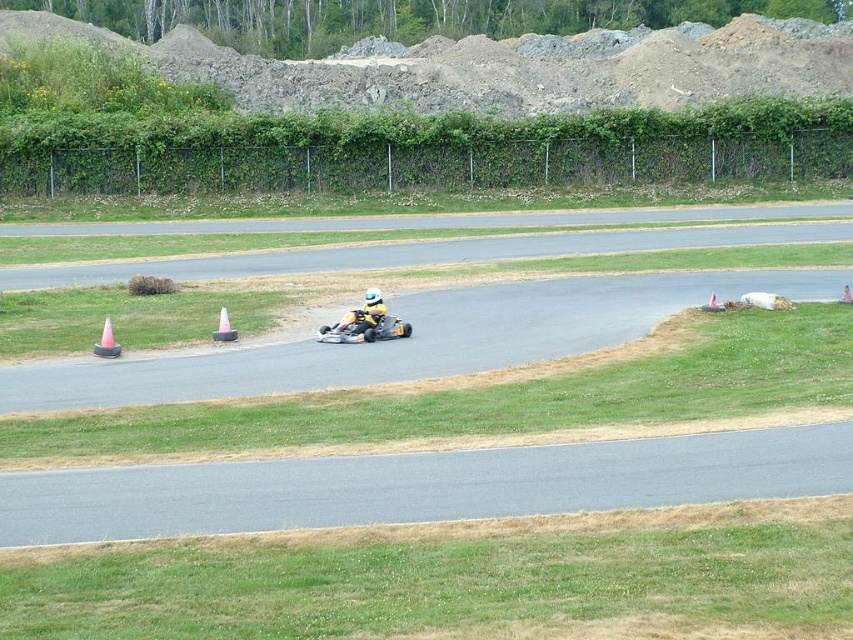
Between point (372, 291) and point (224, 339), which one is positioned behind?

The point (372, 291) is behind.

Can you confirm if yellow matte go-kart at center is wider than orange plastic traffic cone at center?

Yes.

Who is more distant from viewer, (347, 326) or (228, 336)?

Positioned behind is point (347, 326).

Locate an element on the screen. yellow matte go-kart at center is located at coordinates (364, 323).

In the scene shown: Who is positioned more to the left, yellow matte go-kart at center or pink plastic traffic cone at left?

From the viewer's perspective, pink plastic traffic cone at left appears more on the left side.

Who is more forward, (381, 301) or (117, 353)?

Point (117, 353) is in front.

Identify the location of yellow matte go-kart at center. The height and width of the screenshot is (640, 853). (364, 323).

You are a GUI agent. You are given a task and a screenshot of the screen. Output one action in this format:
    pyautogui.click(x=<x>, y=<y>)
    Task: Click on the pink plastic traffic cone at left
    Image resolution: width=853 pixels, height=640 pixels.
    Given the screenshot: What is the action you would take?
    [106, 342]

Between point (106, 333) and point (221, 316), which one is positioned in front?

Point (106, 333) is in front.

Measure the distance between point (107, 349) and camera.

A distance of 23.35 meters exists between point (107, 349) and camera.

I want to click on pink plastic traffic cone at left, so click(106, 342).